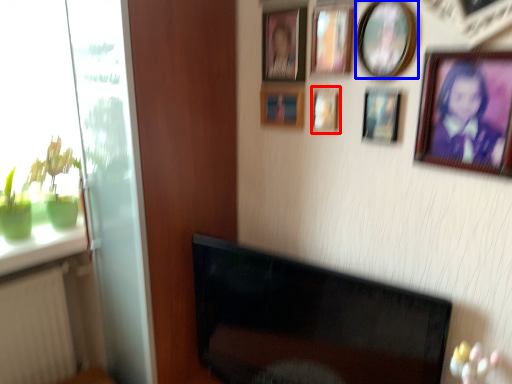
Question: Among these objects, which one is farthest to the camera, picture frame (highlighted by a red box) or picture frame (highlighted by a blue box)?

Choices:
 (A) picture frame
 (B) picture frame

Answer: (A)